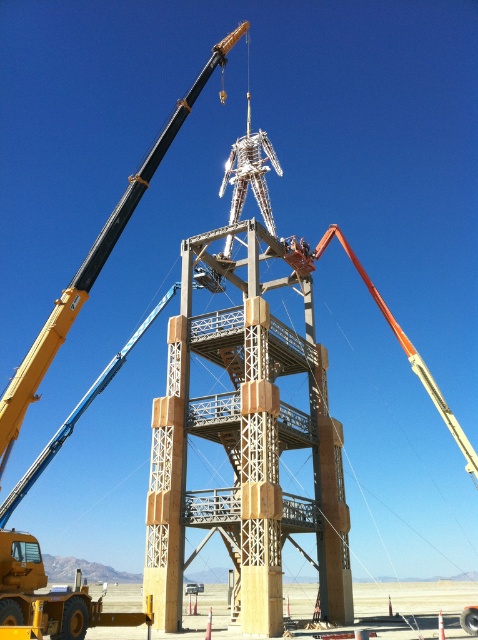
Question: Which point is closer to the camera?

Choices:
 (A) yellow metallic crane arm at upper left
 (B) brown wooden tower at center

Answer: (B)

Question: Can you confirm if brown wooden tower at center is positioned to the left of yellow metallic crane arm at upper left?

Choices:
 (A) yes
 (B) no

Answer: (B)

Question: Can you confirm if brown wooden tower at center is bigger than yellow metallic crane arm at upper left?

Choices:
 (A) no
 (B) yes

Answer: (A)

Question: Can you confirm if brown wooden tower at center is thinner than yellow metallic crane arm at upper left?

Choices:
 (A) no
 (B) yes

Answer: (B)